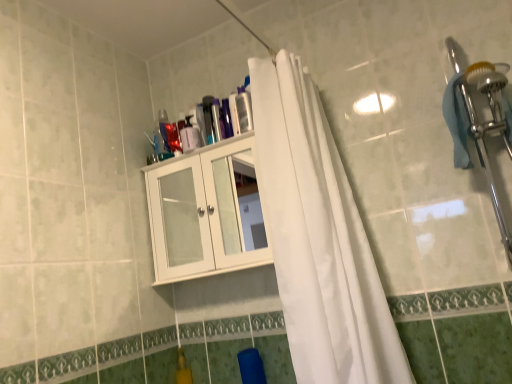
Question: From a real-world perspective, is white glossy cabinet at upper center positioned over transparent plastic bottle at upper center based on gravity?

Choices:
 (A) yes
 (B) no

Answer: (B)

Question: From a real-world perspective, does white glossy cabinet at upper center sit lower than transparent plastic bottle at upper center?

Choices:
 (A) no
 (B) yes

Answer: (B)

Question: Is transparent plastic bottle at upper center at the back of white glossy cabinet at upper center?

Choices:
 (A) no
 (B) yes

Answer: (A)

Question: Considering the relative sizes of white glossy cabinet at upper center and transparent plastic bottle at upper center in the image provided, is white glossy cabinet at upper center shorter than transparent plastic bottle at upper center?

Choices:
 (A) yes
 (B) no

Answer: (B)

Question: Is white glossy cabinet at upper center bigger than transparent plastic bottle at upper center?

Choices:
 (A) yes
 (B) no

Answer: (A)

Question: Looking at the image, does transparent plastic bottle at upper center seem bigger or smaller compared to white glossy cabinet at upper center?

Choices:
 (A) small
 (B) big

Answer: (A)

Question: From a real-world perspective, is transparent plastic bottle at upper center positioned above or below white glossy cabinet at upper center?

Choices:
 (A) below
 (B) above

Answer: (B)

Question: Considering the relative positions of transparent plastic bottle at upper center and white glossy cabinet at upper center in the image provided, is transparent plastic bottle at upper center to the left or to the right of white glossy cabinet at upper center?

Choices:
 (A) left
 (B) right

Answer: (B)

Question: Do you think transparent plastic bottle at upper center is within white glossy cabinet at upper center, or outside of it?

Choices:
 (A) inside
 (B) outside

Answer: (B)

Question: Considering the positions of white glossy cabinet at upper center and transparent plastic bottle at upper center in the image, is white glossy cabinet at upper center bigger or smaller than transparent plastic bottle at upper center?

Choices:
 (A) big
 (B) small

Answer: (A)

Question: From the image's perspective, is white glossy cabinet at upper center positioned above or below transparent plastic bottle at upper center?

Choices:
 (A) above
 (B) below

Answer: (B)

Question: In the image, is white glossy cabinet at upper center on the left side or the right side of transparent plastic bottle at upper center?

Choices:
 (A) left
 (B) right

Answer: (A)

Question: Considering the positions of white glossy cabinet at upper center and transparent plastic bottle at upper center in the image, is white glossy cabinet at upper center wider or thinner than transparent plastic bottle at upper center?

Choices:
 (A) thin
 (B) wide

Answer: (B)

Question: Visually, is white fabric curtain at center positioned to the left or to the right of white glossy cabinet at upper center?

Choices:
 (A) left
 (B) right

Answer: (B)

Question: Is white fabric curtain at center inside the boundaries of white glossy cabinet at upper center, or outside?

Choices:
 (A) inside
 (B) outside

Answer: (B)